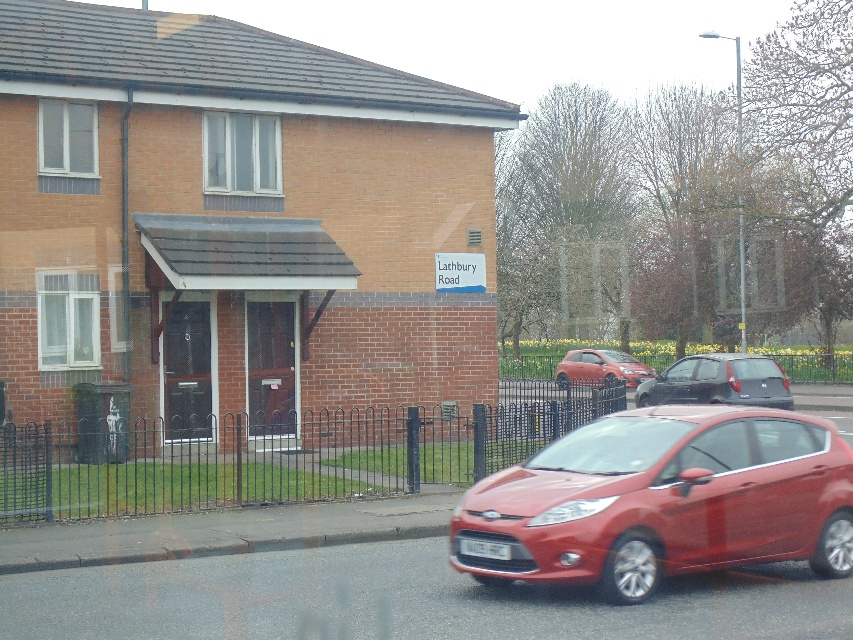
Question: In this image, where is matte red car at lower right located relative to satin black hatchback at center?

Choices:
 (A) above
 (B) below

Answer: (A)

Question: Which point is closer to the camera taking this photo?

Choices:
 (A) (579, 372)
 (B) (660, 563)
 (C) (689, 369)
 (D) (469, 540)

Answer: (B)

Question: Does satin black hatchback at center have a lesser width compared to white plastic license plate at center?

Choices:
 (A) yes
 (B) no

Answer: (A)

Question: Which of the following is the farthest from the observer?

Choices:
 (A) (467, 548)
 (B) (676, 392)
 (C) (519, 472)
 (D) (613, 381)

Answer: (D)

Question: Which point appears closest to the camera in this image?

Choices:
 (A) (575, 356)
 (B) (503, 560)
 (C) (788, 554)

Answer: (B)

Question: Does satin black hatchback at center appear over white plastic license plate at center?

Choices:
 (A) yes
 (B) no

Answer: (A)